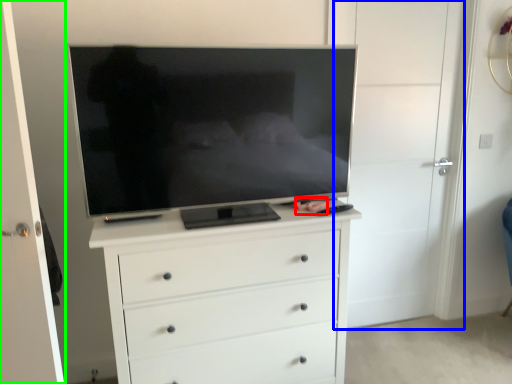
Question: Considering the real-world distances, which object is farthest from person (highlighted by a red box)? door (highlighted by a blue box) or door (highlighted by a green box)?

Choices:
 (A) door
 (B) door

Answer: (B)